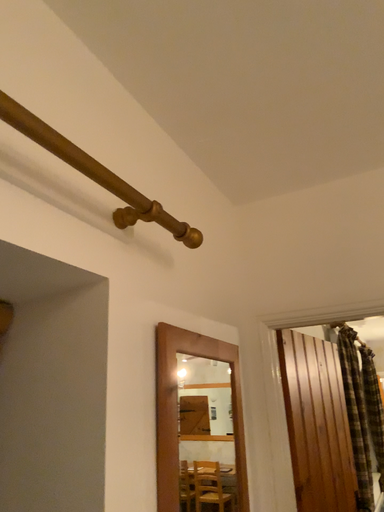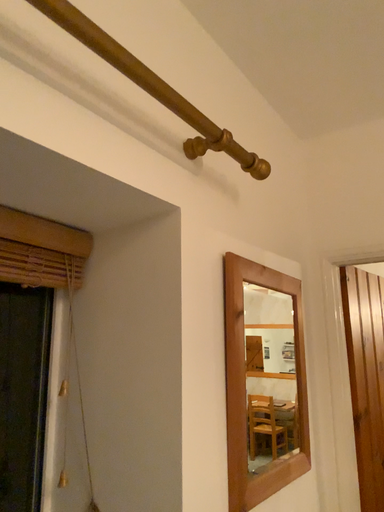
Question: Which way did the camera rotate in the video?

Choices:
 (A) rotated upward
 (B) rotated downward

Answer: (B)